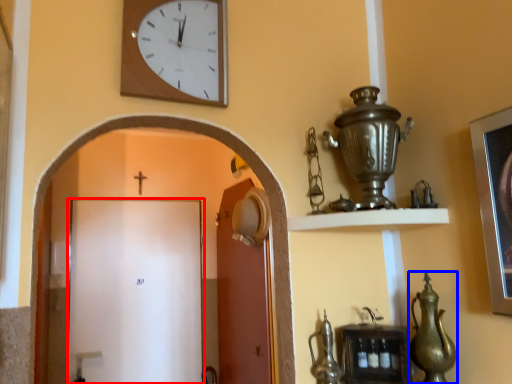
Question: Among these objects, which one is nearest to the camera, door (highlighted by a red box) or tea pot (highlighted by a blue box)?

Choices:
 (A) door
 (B) tea pot

Answer: (B)